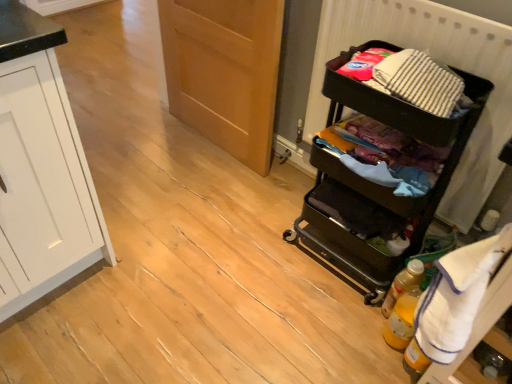
Image resolution: width=512 pixels, height=384 pixels. In order to click on free area in between wooden door at center and black plastic cart at right in this screenshot , I will do `click(254, 183)`.